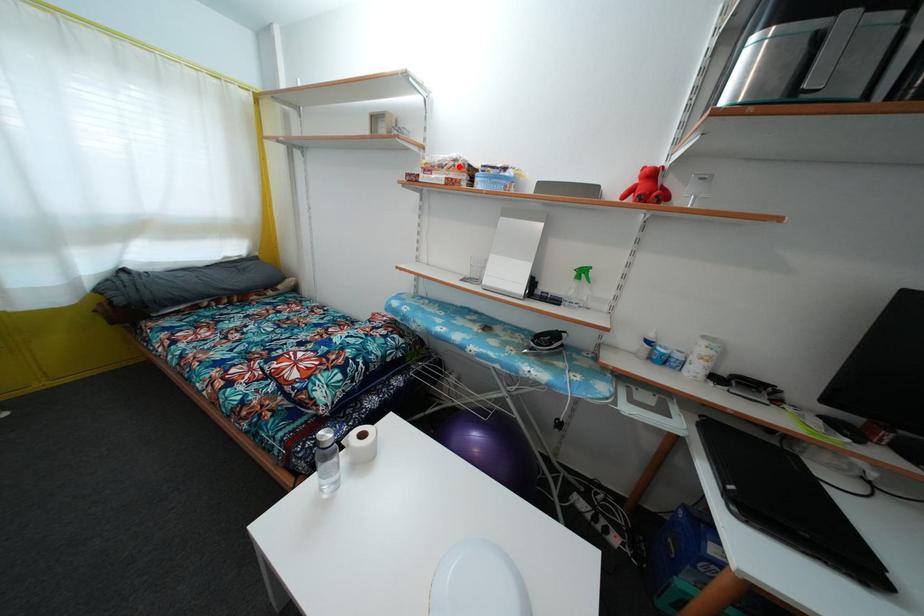
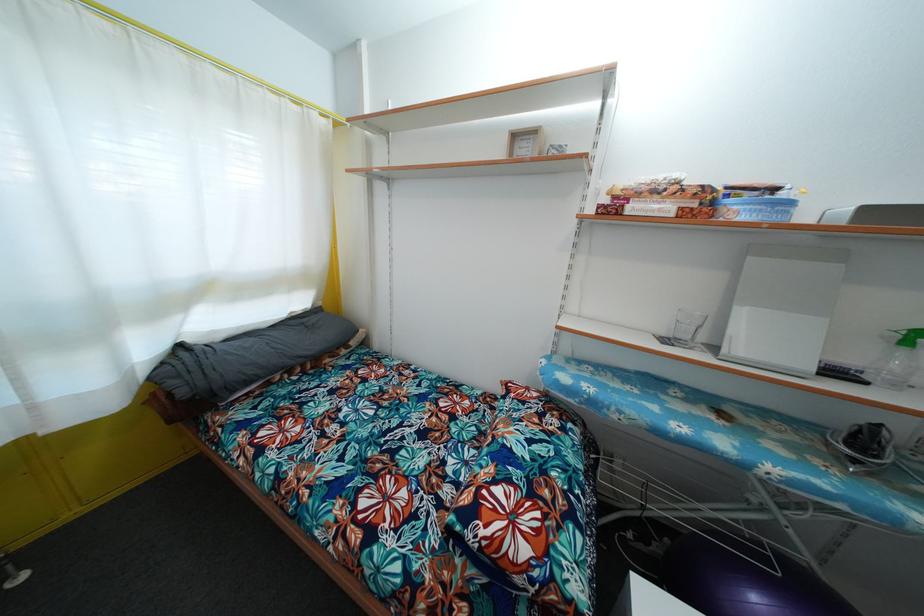
Question: I am providing you with two images of the same scene from different viewpoints. A red point is marked on the first image. Can you still see the location of the red point in image 2?

Choices:
 (A) Yes
 (B) No

Answer: (A)